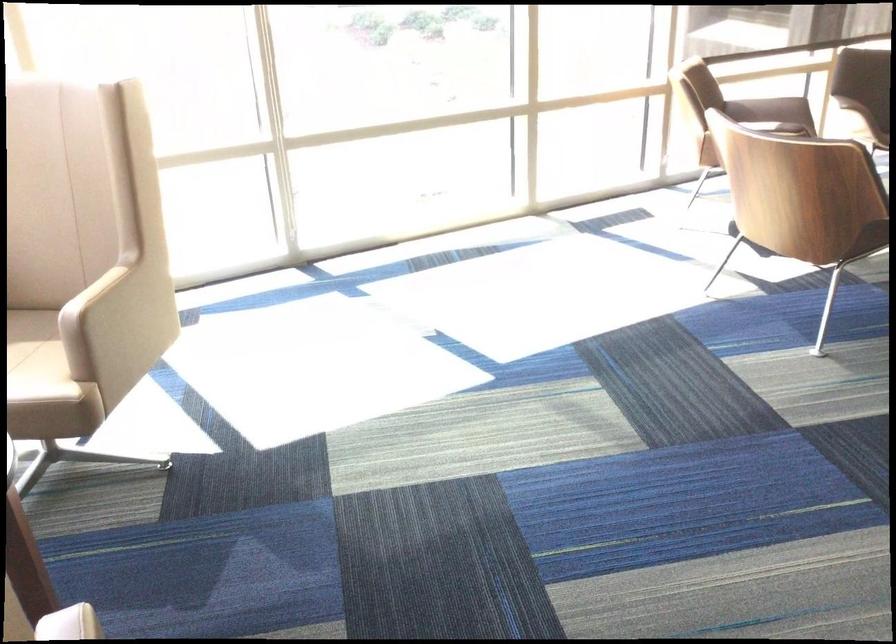
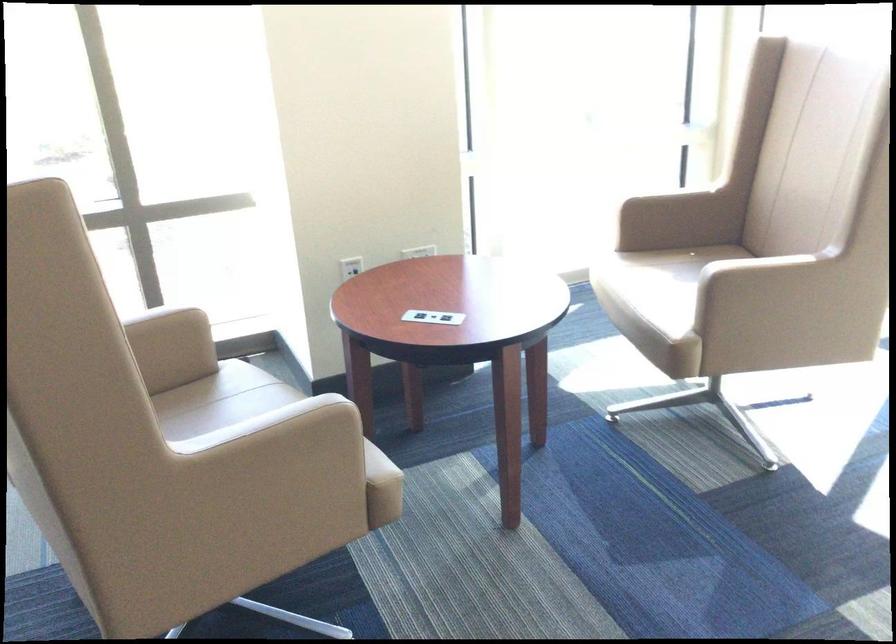
The point at (97, 308) is marked in the first image. Where is the corresponding point in the second image?

(744, 270)